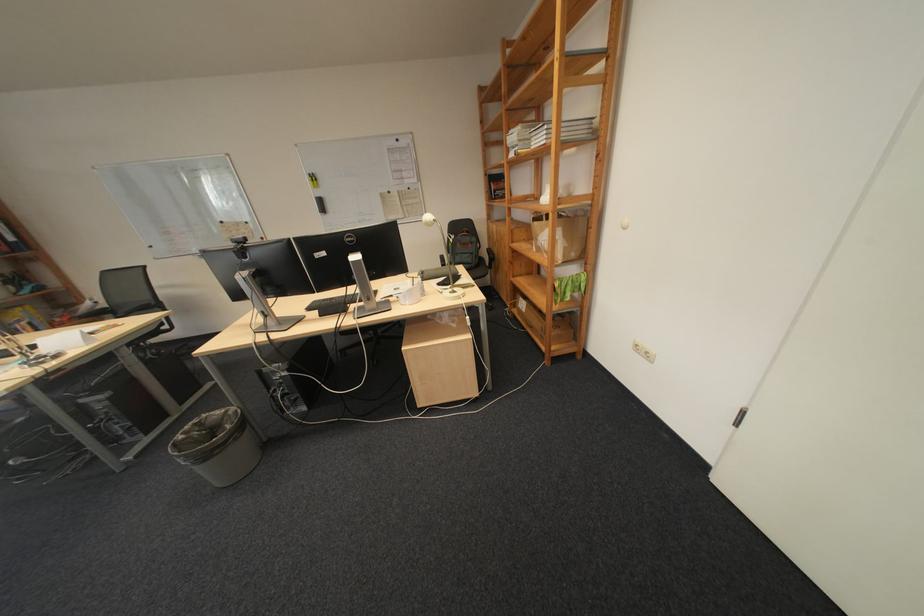
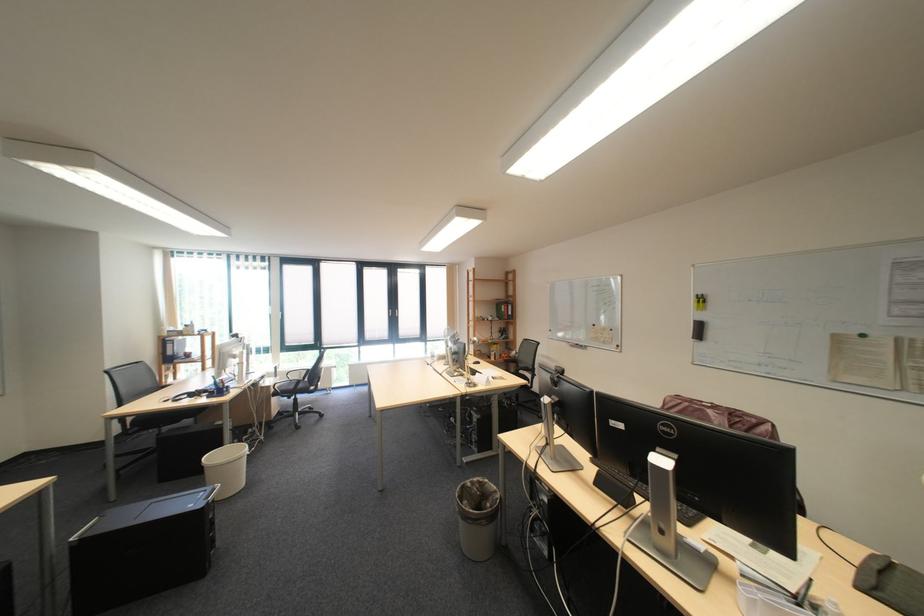
Question: The first image is from the beginning of the video and the second image is from the end. How did the camera likely rotate when shooting the video?

Choices:
 (A) Left
 (B) Right
 (C) Up
 (D) Down

Answer: (A)